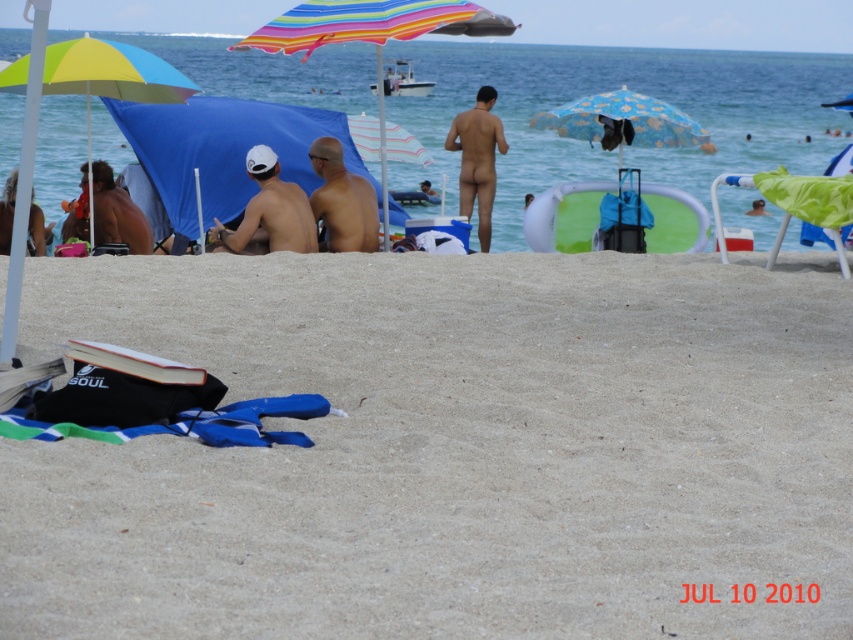
You are a beachgoer who wants to place your skinny white cap at center on top of the translucent green inflatable ring at center. Can you do that based on their sizes?

The translucent green inflatable ring at center is larger in size than the skinny white cap at center, so yes, you can place the skinny white cap at center on top of the translucent green inflatable ring at center since it is bigger.

You are a photographer on the beach and want to capture both the translucent green inflatable ring at center and the brown matte skin at center in the same frame. Which object should you position to the left side of your camera frame to include both?

To include both the translucent green inflatable ring at center and the brown matte skin at center in the same frame, position the brown matte skin at center on the left side of your camera frame since the translucent green inflatable ring at center is already to its right.